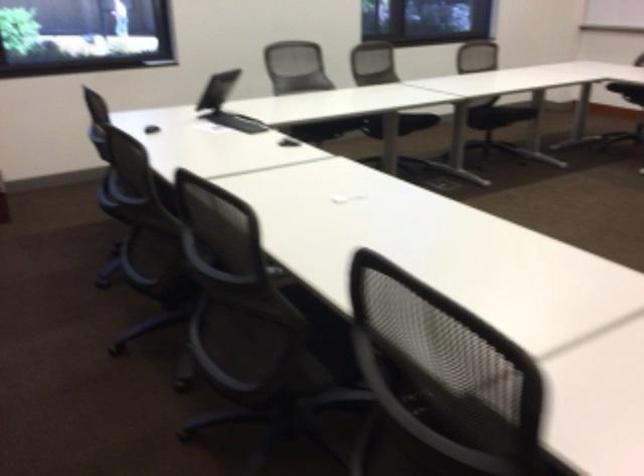
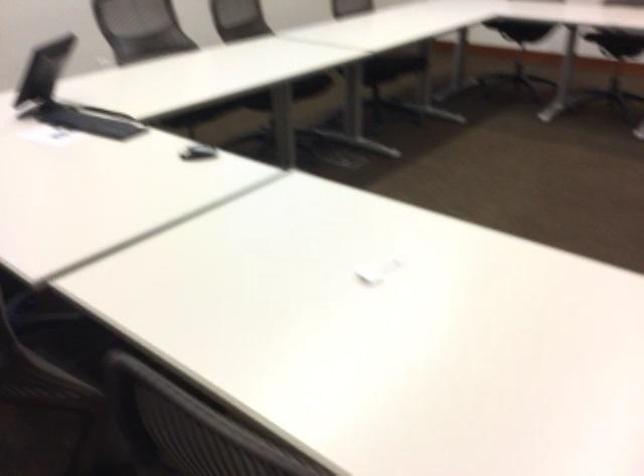
Question: What movement of the cameraman would produce the second image?

Choices:
 (A) Left
 (B) Right
 (C) Forward
 (D) Backward

Answer: (D)